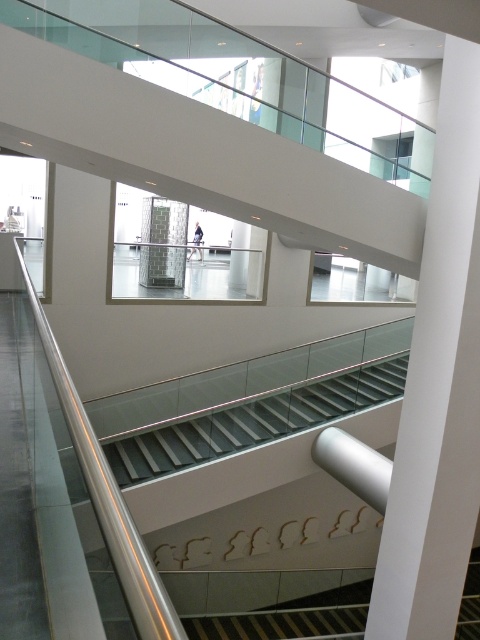
Question: Does white smooth pillar at center come behind white glossy stair at center?

Choices:
 (A) yes
 (B) no

Answer: (B)

Question: Which of the following is the closest to the observer?

Choices:
 (A) (429, 308)
 (B) (300, 394)

Answer: (A)

Question: Is white smooth pillar at center wider than white glossy stair at center?

Choices:
 (A) no
 (B) yes

Answer: (A)

Question: Which object is closer to the camera taking this photo?

Choices:
 (A) white smooth pillar at center
 (B) white glossy stair at center

Answer: (A)

Question: Can you confirm if white smooth pillar at center is positioned below white glossy stair at center?

Choices:
 (A) no
 (B) yes

Answer: (A)